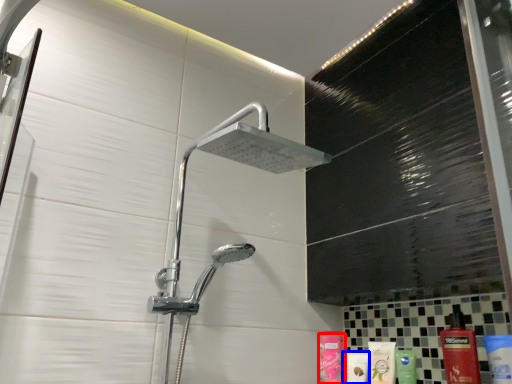
Question: Which point is further to the camera, toiletry (highlighted by a red box) or toiletry (highlighted by a blue box)?

Choices:
 (A) toiletry
 (B) toiletry

Answer: (A)